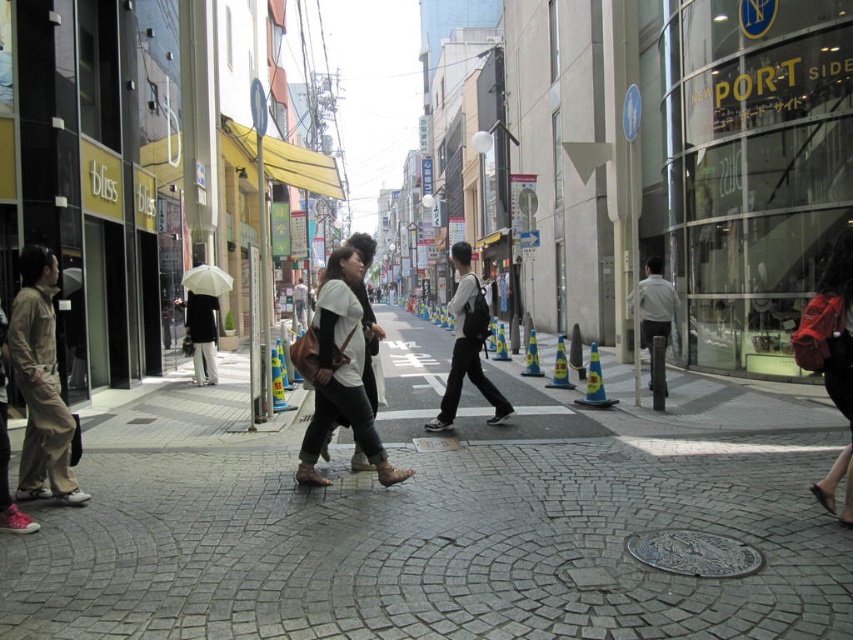
Is point (451, 420) less distant than point (633, 291)?

Yes, it is in front of point (633, 291).

Can you confirm if matte black backpack at center is thinner than light gray shirt at center?

No, matte black backpack at center is not thinner than light gray shirt at center.

Who is more forward, (488, 397) or (660, 269)?

Point (488, 397)

Find the location of a particular element. This screenshot has height=640, width=853. matte black backpack at center is located at coordinates (x=467, y=344).

Is the position of gray cobblestone pavement at center more distant than that of white matte umbrella at center?

No.

Between point (158, 467) and point (212, 384), which one is positioned in front?

Point (158, 467) is more forward.

Find the location of a particular element. The width and height of the screenshot is (853, 640). gray cobblestone pavement at center is located at coordinates (434, 525).

Looking at this image, does matte black backpack at center have a greater height compared to matte white shirt at center?

Correct, matte black backpack at center is much taller as matte white shirt at center.

Who is taller, matte black backpack at center or matte white shirt at center?

matte black backpack at center is taller.

Identify the location of matte black backpack at center. (467, 344).